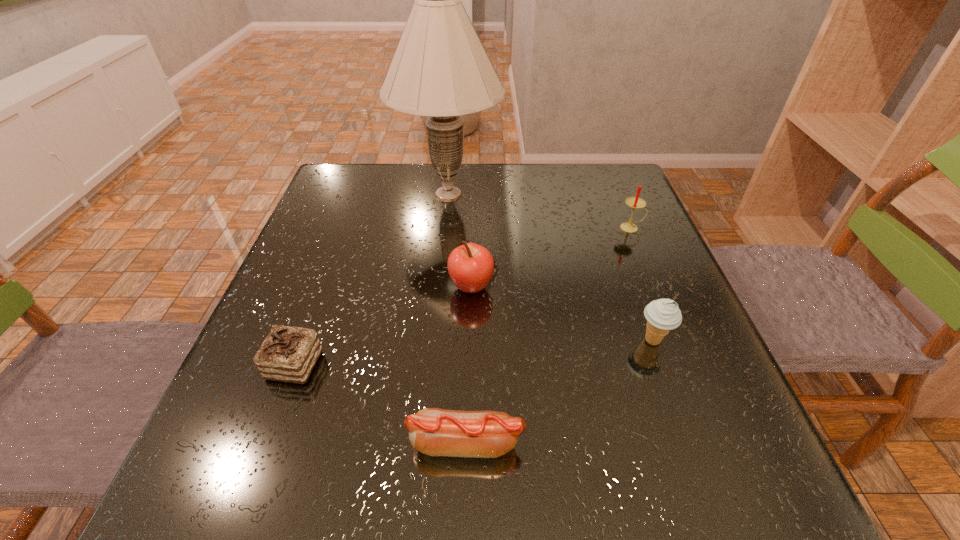
Where is `free space between the lampshade and the third farthest object`? free space between the lampshade and the third farthest object is located at coordinates (460, 240).

Where is `free spot between the third farthest object and the icecream`? The image size is (960, 540). free spot between the third farthest object and the icecream is located at coordinates (562, 314).

Identify the location of unoccupied position between the leftmost object and the icecream. pos(474,353).

Where is `unoccupied area between the candle and the nearest object`? The height and width of the screenshot is (540, 960). unoccupied area between the candle and the nearest object is located at coordinates (548, 335).

The image size is (960, 540). What are the coordinates of `free space between the third farthest object and the lampshade` in the screenshot? It's located at (460, 240).

Identify which object is located as the fifth nearest to the apple. Please provide its 2D coordinates. Your answer should be formatted as a tuple, i.e. [(x, y)], where the tuple contains the x and y coordinates of a point satisfying the conditions above.

[(634, 202)]

Image resolution: width=960 pixels, height=540 pixels. Find the location of `object that can be found as the second closest to the sausage`. object that can be found as the second closest to the sausage is located at coordinates coord(662,315).

You are a GUI agent. You are given a task and a screenshot of the screen. Output one action in this format:
    pyautogui.click(x=<x>, y=<y>)
    Task: Click on the vacant region that satisfies the following two spatial constraints: 1. on the back side of the fourth nearest object; 2. on the right side of the sausage
    The height and width of the screenshot is (540, 960).
    Given the screenshot: What is the action you would take?
    pyautogui.click(x=469, y=287)

Locate an element on the screen. vacant region that satisfies the following two spatial constraints: 1. on the front side of the lampshade; 2. on the left side of the nearest object is located at coordinates tap(424, 443).